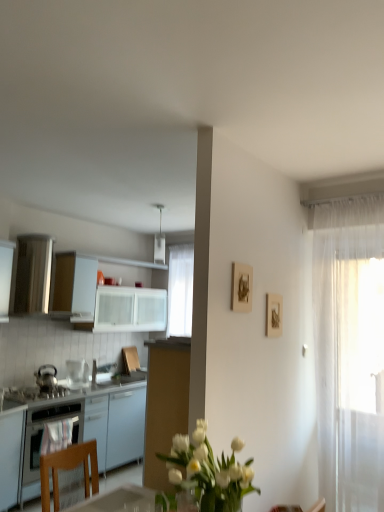
Question: Considering the relative positions of shiny metallic kettle at left, acting as the 1th kitchen appliance starting from the left, and white glossy microwave at upper left, the first kitchen appliance from the right, in the image provided, is shiny metallic kettle at left, acting as the 1th kitchen appliance starting from the left, in front of white glossy microwave at upper left, the first kitchen appliance from the right,?

Choices:
 (A) no
 (B) yes

Answer: (B)

Question: Is shiny metallic kettle at left, acting as the 1th kitchen appliance starting from the left, smaller than white glossy microwave at upper left, the first kitchen appliance from the right?

Choices:
 (A) no
 (B) yes

Answer: (B)

Question: Is white glossy microwave at upper left, positioned as the second kitchen appliance in left-to-right order, inside shiny metallic kettle at left, acting as the 1th kitchen appliance starting from the left?

Choices:
 (A) no
 (B) yes

Answer: (A)

Question: Does shiny metallic kettle at left, acting as the second kitchen appliance starting from the right, turn towards white glossy microwave at upper left, positioned as the second kitchen appliance in left-to-right order?

Choices:
 (A) yes
 (B) no

Answer: (B)

Question: Does shiny metallic kettle at left, acting as the 1th kitchen appliance starting from the left, have a lesser height compared to white glossy microwave at upper left, positioned as the second kitchen appliance in left-to-right order?

Choices:
 (A) yes
 (B) no

Answer: (A)

Question: Is satin black stove at lower left bigger or smaller than white glossy cabinet at upper left, positioned as the 1th cabinetry in top-to-bottom order?

Choices:
 (A) big
 (B) small

Answer: (B)

Question: From a real-world perspective, is satin black stove at lower left physically located above or below white glossy cabinet at upper left, positioned as the 1th cabinetry in top-to-bottom order?

Choices:
 (A) below
 (B) above

Answer: (A)

Question: Considering the positions of point (34, 394) and point (64, 254), is point (34, 394) closer or farther from the camera than point (64, 254)?

Choices:
 (A) farther
 (B) closer

Answer: (B)

Question: Considering the relative positions of satin black stove at lower left and white glossy cabinet at upper left, positioned as the 1th cabinetry in top-to-bottom order, in the image provided, is satin black stove at lower left to the left or to the right of white glossy cabinet at upper left, positioned as the 1th cabinetry in top-to-bottom order,?

Choices:
 (A) right
 (B) left

Answer: (B)

Question: From the image's perspective, relative to white glossy cabinet at upper left, the second cabinetry in the bottom-to-top sequence, is white glossy cabinets at left, positioned as the 1th cabinetry in bottom-to-top order, above or below?

Choices:
 (A) above
 (B) below

Answer: (B)

Question: Is white glossy cabinets at left, positioned as the 1th cabinetry in bottom-to-top order, to the left or to the right of white glossy cabinet at upper left, positioned as the 1th cabinetry in top-to-bottom order, in the image?

Choices:
 (A) right
 (B) left

Answer: (B)

Question: Is white glossy cabinets at left, arranged as the 2th cabinetry when viewed from the top, taller or shorter than white glossy cabinet at upper left, the second cabinetry in the bottom-to-top sequence?

Choices:
 (A) short
 (B) tall

Answer: (B)

Question: Considering the positions of white glossy cabinets at left, arranged as the 2th cabinetry when viewed from the top, and white glossy cabinet at upper left, positioned as the 1th cabinetry in top-to-bottom order, in the image, is white glossy cabinets at left, arranged as the 2th cabinetry when viewed from the top, bigger or smaller than white glossy cabinet at upper left, positioned as the 1th cabinetry in top-to-bottom order,?

Choices:
 (A) big
 (B) small

Answer: (A)

Question: Based on their sizes in the image, would you say sheer white curtain at right is bigger or smaller than matte wooden picture frame at upper right, positioned as the first picture frame in left-to-right order?

Choices:
 (A) big
 (B) small

Answer: (A)

Question: Does point [336, 320] appear closer or farther from the camera than point [240, 305]?

Choices:
 (A) closer
 (B) farther

Answer: (B)